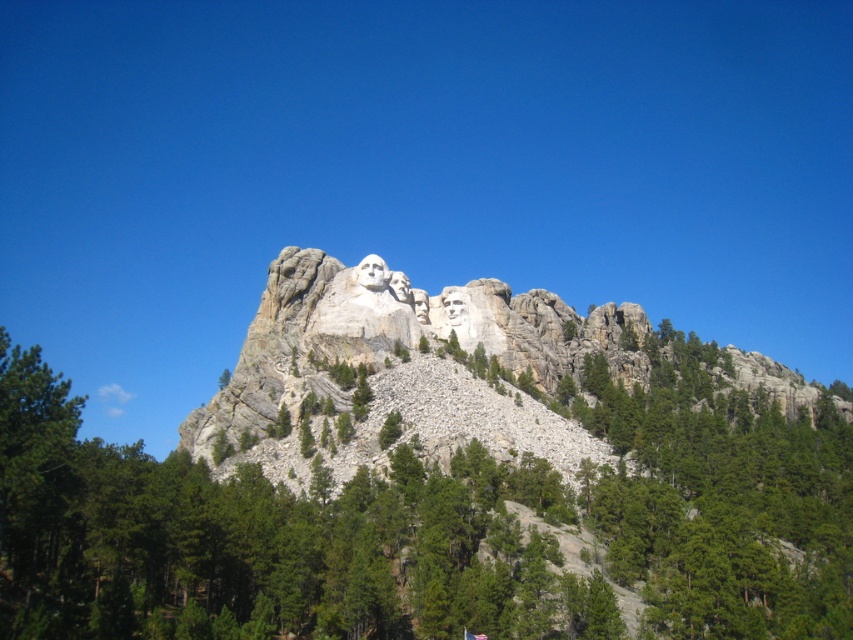
You are standing at the base of Mount Rushmore and notice a green leafy tree at center and a white stone mountain at center. Which object is nearer to you?

The green leafy tree at center is closer to the viewer than the white stone mountain at center.

You are standing at the base of Mount Rushmore and want to take a photo of the point at coordinate (129, 582). If your camera has a maximum range of 60 meters, will you be able to capture that point in your photo?

The point at coordinate (129, 582) is 67.37 meters away from the camera, which exceeds the camera maximum range of 60 meters. Therefore, you will not be able to capture that point in your photo.

You are a photographer planning to capture a photo of the green leafy tree at center and the white stone mountain at center from a viewpoint that is level with the base of the mountain. Will the tree block your view of the mountain?

The green leafy tree at center is located below the white stone mountain at center, so the tree will block the view of the mountain from a viewpoint level with the base of the mountain.